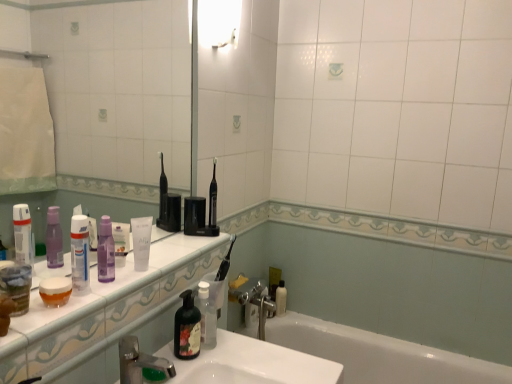
You are a GUI agent. You are given a task and a screenshot of the screen. Output one action in this format:
    pyautogui.click(x=<x>, y=<y>)
    Task: Click on the blank space situated above white glossy countertop at lower left (from a real-world perspective)
    
    Given the screenshot: What is the action you would take?
    pyautogui.click(x=129, y=272)